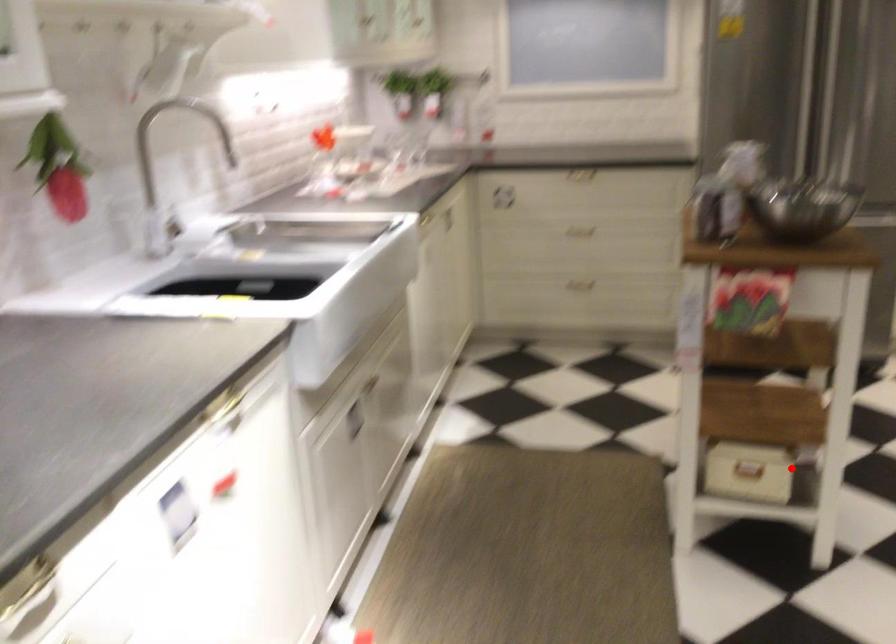
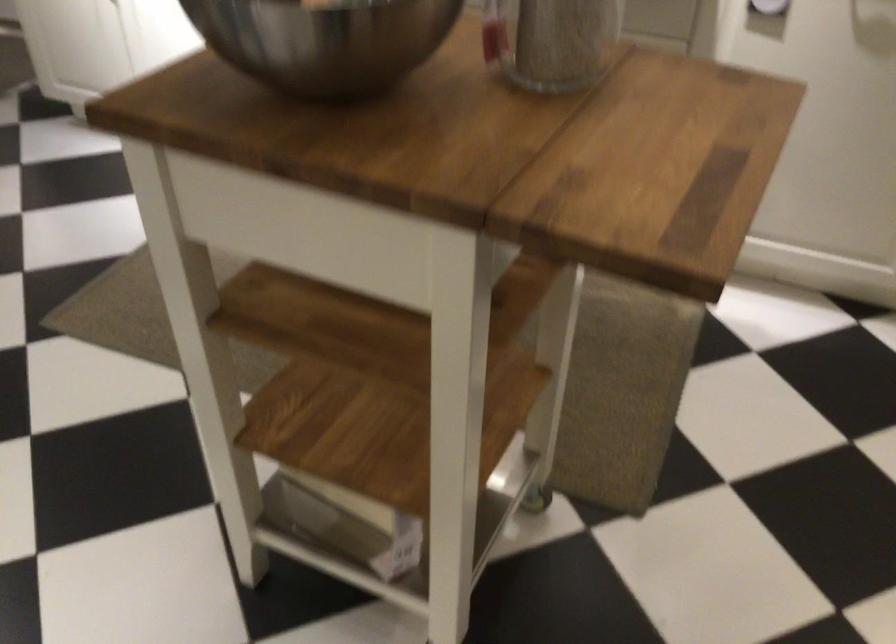
Question: I am providing you with two images of the same scene from different viewpoints. Given a red point in image1, look at the same physical point in image2. Is it:

Choices:
 (A) Closer to the viewpoint
 (B) Farther from the viewpoint

Answer: (A)